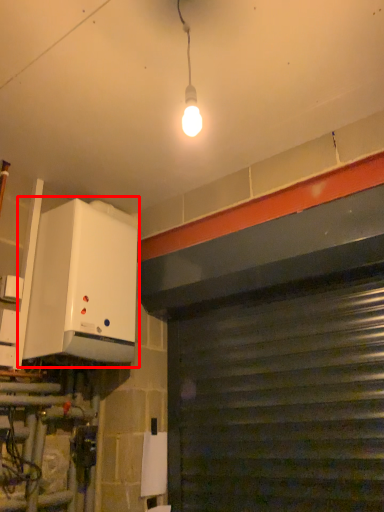
Question: Where is appliance (annotated by the red box) located in relation to garage door in the image?

Choices:
 (A) left
 (B) right

Answer: (A)